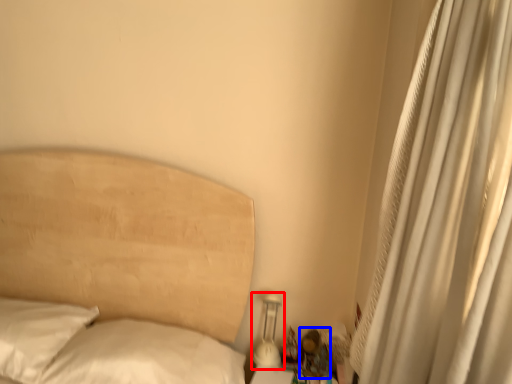
Question: Among these objects, which one is nearest to the camera, bedside lamp (highlighted by a red box) or miniature (highlighted by a blue box)?

Choices:
 (A) bedside lamp
 (B) miniature

Answer: (B)